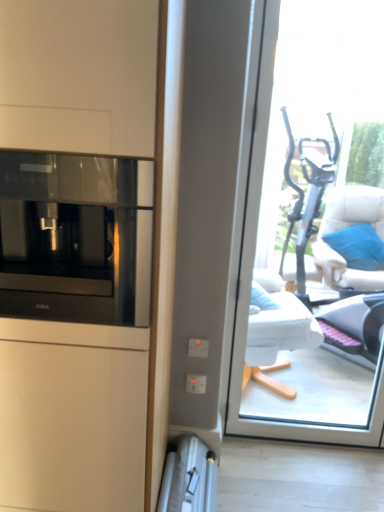
Question: Is silver metallic ladder at lower center taller than transparent glass window at center?

Choices:
 (A) no
 (B) yes

Answer: (A)

Question: Is silver metallic ladder at lower center positioned far away from transparent glass window at center?

Choices:
 (A) no
 (B) yes

Answer: (B)

Question: From a real-world perspective, is silver metallic ladder at lower center below transparent glass window at center?

Choices:
 (A) yes
 (B) no

Answer: (A)

Question: From the image's perspective, is silver metallic ladder at lower center under transparent glass window at center?

Choices:
 (A) no
 (B) yes

Answer: (B)

Question: Is silver metallic ladder at lower center with transparent glass window at center?

Choices:
 (A) yes
 (B) no

Answer: (B)

Question: Is the depth of silver metallic ladder at lower center less than that of transparent glass window at center?

Choices:
 (A) yes
 (B) no

Answer: (A)

Question: Is white fabric chair at right smaller than silver metallic ladder at lower center?

Choices:
 (A) yes
 (B) no

Answer: (B)

Question: From the image's perspective, is white fabric chair at right under silver metallic ladder at lower center?

Choices:
 (A) no
 (B) yes

Answer: (A)

Question: Does white fabric chair at right turn towards silver metallic ladder at lower center?

Choices:
 (A) yes
 (B) no

Answer: (B)

Question: Can you confirm if white fabric chair at right is thinner than silver metallic ladder at lower center?

Choices:
 (A) no
 (B) yes

Answer: (A)

Question: Considering the relative sizes of white fabric chair at right and silver metallic ladder at lower center in the image provided, is white fabric chair at right taller than silver metallic ladder at lower center?

Choices:
 (A) yes
 (B) no

Answer: (A)

Question: Are white fabric chair at right and silver metallic ladder at lower center making contact?

Choices:
 (A) yes
 (B) no

Answer: (B)

Question: From the image's perspective, is white fabric chair at right over black glass microwave at left?

Choices:
 (A) no
 (B) yes

Answer: (A)